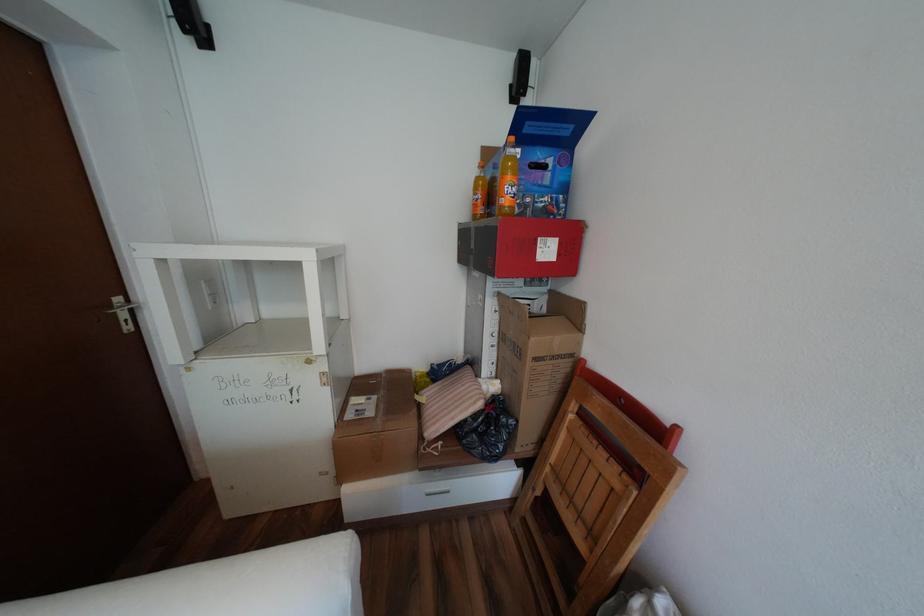
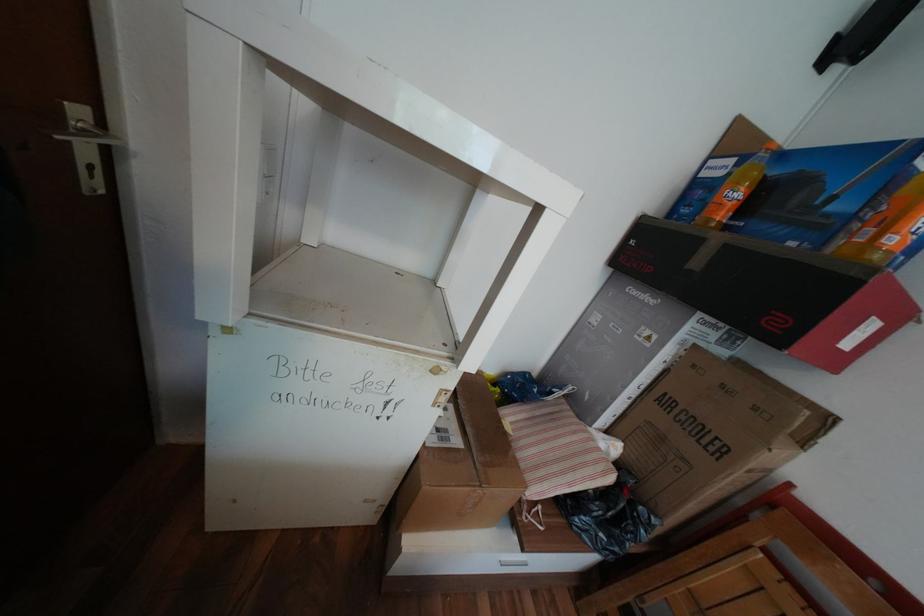
In a continuous first-person perspective shot, in which direction is the camera moving?

The movement direction of the cameraman is left, forward.